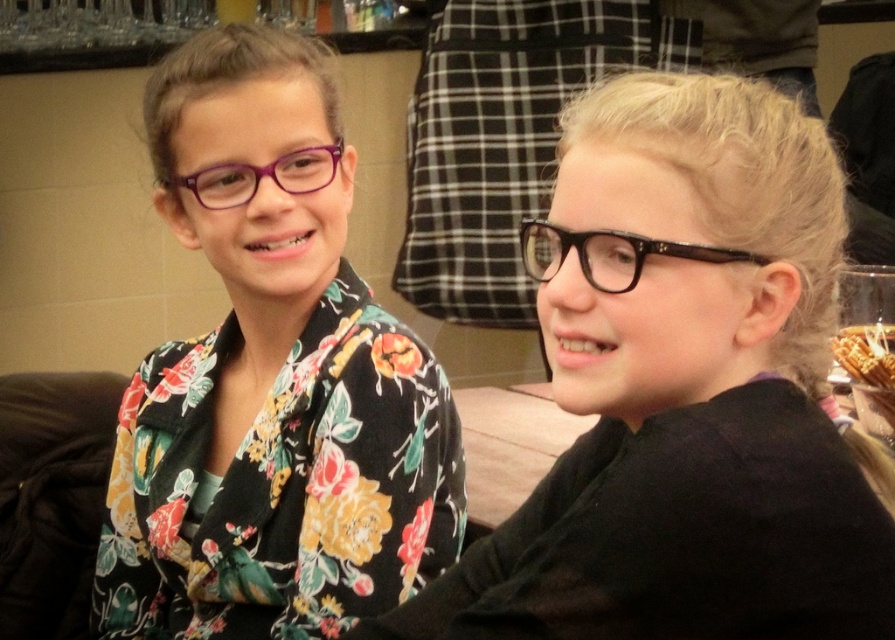
Looking at this image, you are trying to identify the glasses worn by the two girls in the image. The black glossy glasses at upper right and the black textured glasses at right are both present. Based on their positions, which glasses are positioned lower in the frame?

The black glossy glasses at upper right are located below the black textured glasses at right, so the black glossy glasses at upper right are positioned lower in the frame.